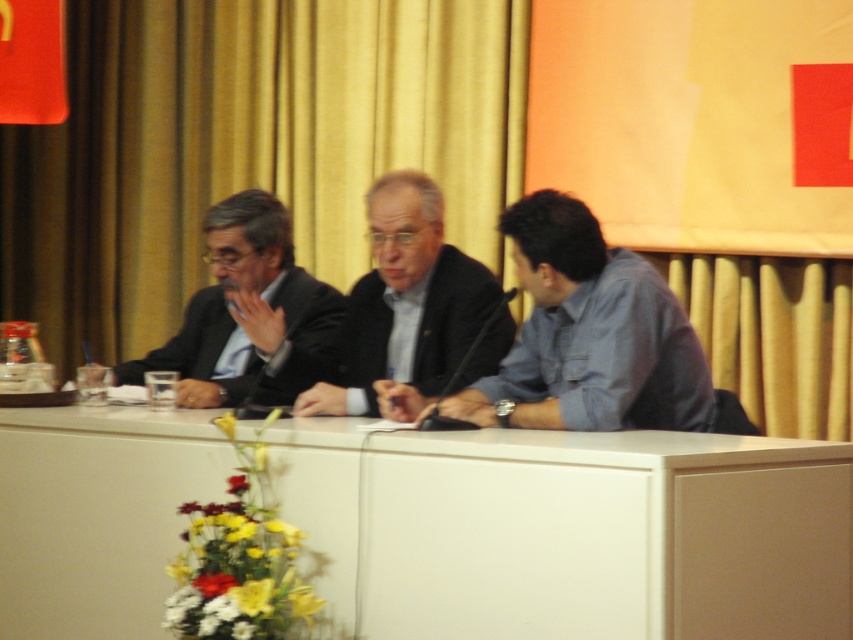
Question: From the image, what is the correct spatial relationship of black matte suit at center in relation to matte black suit at left?

Choices:
 (A) above
 (B) below

Answer: (A)

Question: Which point is farther to the camera?

Choices:
 (A) (248, 356)
 (B) (744, 593)

Answer: (A)

Question: Where is white glossy table at center located in relation to matte black suit at left in the image?

Choices:
 (A) right
 (B) left

Answer: (A)

Question: Among these objects, which one is nearest to the camera?

Choices:
 (A) light blue shirt at center
 (B) matte black suit at left

Answer: (A)

Question: Among these objects, which one is farthest from the camera?

Choices:
 (A) white glossy table at center
 (B) matte black suit at left
 (C) light blue shirt at center
 (D) black matte suit at center

Answer: (B)

Question: Does light blue shirt at center lie in front of matte black suit at left?

Choices:
 (A) no
 (B) yes

Answer: (B)